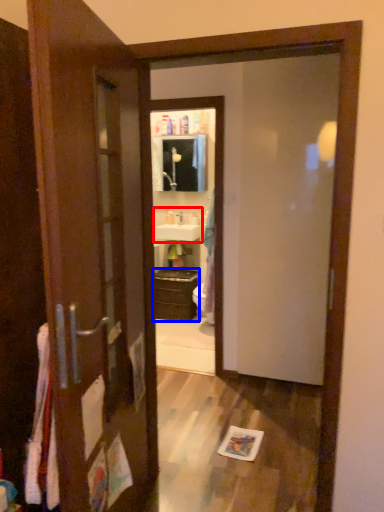
Question: Among these objects, which one is farthest to the camera, sink (highlighted by a red box) or cabinetry (highlighted by a blue box)?

Choices:
 (A) sink
 (B) cabinetry

Answer: (A)